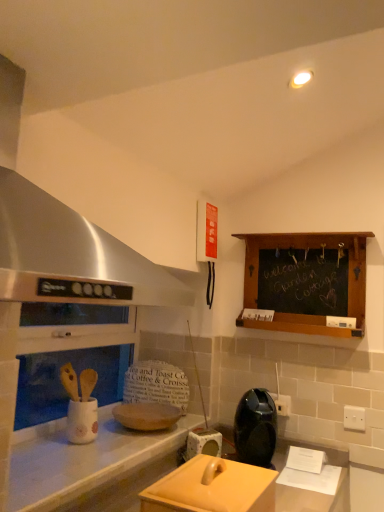
I want to click on empty space that is ontop of chalkboard wood at upper right (from a real-world perspective), so click(x=321, y=228).